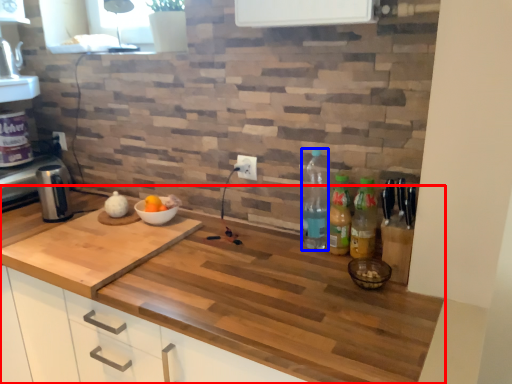
Question: Which of the following is the closest to the observer, countertop (highlighted by a red box) or bottle (highlighted by a blue box)?

Choices:
 (A) countertop
 (B) bottle

Answer: (A)